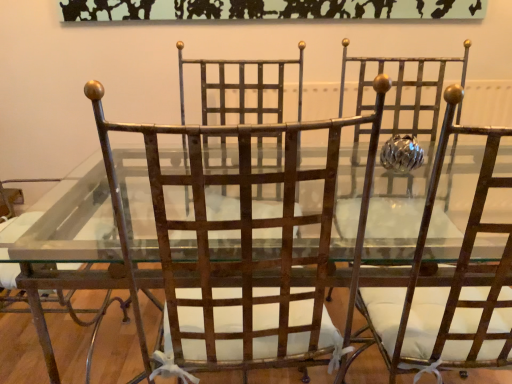
The height and width of the screenshot is (384, 512). What do you see at coordinates (447, 284) in the screenshot?
I see `rusty metal chair at center, which appears as the 3th chair when viewed from the left` at bounding box center [447, 284].

Measure the distance between point [266,283] and camera.

The distance of point [266,283] from camera is 35.47 inches.

Identify the location of rusty metal chair at center, which appears as the 3th chair when viewed from the left. (447, 284).

Measure the distance between rusty metal chair at left, arranged as the 1th chair when viewed from the left, and rusty metal chair at center, which appears as the 3th chair when viewed from the left.

rusty metal chair at left, arranged as the 1th chair when viewed from the left, and rusty metal chair at center, which appears as the 3th chair when viewed from the left, are 28.32 inches apart.

Is rusty metal chair at left, marked as the 3th chair in a right-to-left arrangement, facing towards rusty metal chair at center, which appears as the 3th chair when viewed from the left?

No, rusty metal chair at left, marked as the 3th chair in a right-to-left arrangement, is not facing towards rusty metal chair at center, which appears as the 3th chair when viewed from the left.

Is rusty metal chair at left, arranged as the 1th chair when viewed from the left, inside or outside of rusty metal chair at center, which appears as the 3th chair when viewed from the left?

rusty metal chair at left, arranged as the 1th chair when viewed from the left, exists outside the volume of rusty metal chair at center, which appears as the 3th chair when viewed from the left.

Is rusty metal chair at left, marked as the 3th chair in a right-to-left arrangement, bigger or smaller than rusty metal chair at center, arranged as the 1th chair when viewed from the right?

rusty metal chair at left, marked as the 3th chair in a right-to-left arrangement, is bigger than rusty metal chair at center, arranged as the 1th chair when viewed from the right.

Does rusty metal chair at left, marked as the 3th chair in a right-to-left arrangement, have a smaller size compared to rusty metal chair at center, which is counted as the 2th chair, starting from the right?

Incorrect, rusty metal chair at left, marked as the 3th chair in a right-to-left arrangement, is not smaller in size than rusty metal chair at center, which is counted as the 2th chair, starting from the right.

Is there a large distance between rusty metal chair at left, marked as the 3th chair in a right-to-left arrangement, and rusty metal chair at center, which is counted as the 2th chair, starting from the right?

No.

Is rusty metal chair at left, marked as the 3th chair in a right-to-left arrangement, oriented away from rusty metal chair at center, which is counted as the 2th chair, starting from the right?

No, rusty metal chair at left, marked as the 3th chair in a right-to-left arrangement, is not facing away from rusty metal chair at center, which is counted as the 2th chair, starting from the right.

Considering the relative sizes of rusty metal chair at left, marked as the 3th chair in a right-to-left arrangement, and rusty metal chair at center, acting as the 2th chair starting from the left, in the image provided, is rusty metal chair at left, marked as the 3th chair in a right-to-left arrangement, thinner than rusty metal chair at center, acting as the 2th chair starting from the left,?

Incorrect, the width of rusty metal chair at left, marked as the 3th chair in a right-to-left arrangement, is not less than that of rusty metal chair at center, acting as the 2th chair starting from the left.

Is point (153, 199) farther from camera compared to point (46, 338)?

No, it is not.

How many degrees apart are the facing directions of rusty metal chair at center, which is counted as the 2th chair, starting from the right, and rusty metal chair at left, marked as the 3th chair in a right-to-left arrangement?

The angular difference between rusty metal chair at center, which is counted as the 2th chair, starting from the right, and rusty metal chair at left, marked as the 3th chair in a right-to-left arrangement, is 6.52 degrees.

Could rusty metal chair at left, arranged as the 1th chair when viewed from the left, be considered to be inside rusty metal chair at center, acting as the 2th chair starting from the left?

No, rusty metal chair at left, arranged as the 1th chair when viewed from the left, is not a part of rusty metal chair at center, acting as the 2th chair starting from the left.

Relative to rusty metal chair at left, arranged as the 1th chair when viewed from the left, is rusty metal chair at center, which is counted as the 2th chair, starting from the right, in front or behind?

Clearly, rusty metal chair at center, which is counted as the 2th chair, starting from the right, is in front of rusty metal chair at left, arranged as the 1th chair when viewed from the left.

Can you confirm if rusty metal chair at center, acting as the 2th chair starting from the left, is bigger than rusty metal chair at center, which appears as the 3th chair when viewed from the left?

No.

How many degrees apart are the facing directions of rusty metal chair at center, acting as the 2th chair starting from the left, and rusty metal chair at center, which appears as the 3th chair when viewed from the left?

0.00026 degrees separate the facing orientations of rusty metal chair at center, acting as the 2th chair starting from the left, and rusty metal chair at center, which appears as the 3th chair when viewed from the left.

Is rusty metal chair at center, which is counted as the 2th chair, starting from the right, at the right side of rusty metal chair at center, which appears as the 3th chair when viewed from the left?

In fact, rusty metal chair at center, which is counted as the 2th chair, starting from the right, is to the left of rusty metal chair at center, which appears as the 3th chair when viewed from the left.

Is rusty metal chair at center, arranged as the 1th chair when viewed from the right, taller or shorter than rusty metal chair at center, which is counted as the 2th chair, starting from the right?

Clearly, rusty metal chair at center, arranged as the 1th chair when viewed from the right, is shorter compared to rusty metal chair at center, which is counted as the 2th chair, starting from the right.

Who is smaller, rusty metal chair at center, which appears as the 3th chair when viewed from the left, or rusty metal chair at center, acting as the 2th chair starting from the left?

Smaller between the two is rusty metal chair at center, acting as the 2th chair starting from the left.

From the image's perspective, relative to rusty metal chair at center, which is counted as the 2th chair, starting from the right, is rusty metal chair at center, arranged as the 1th chair when viewed from the right, above or below?

Clearly, from the image's perspective, rusty metal chair at center, arranged as the 1th chair when viewed from the right, is above rusty metal chair at center, which is counted as the 2th chair, starting from the right.

Is point (400, 313) farther from camera compared to point (375, 86)?

Yes, point (400, 313) is farther from viewer.

Which point is more forward, (389,371) or (71,292)?

Point (389,371)

Which is correct: rusty metal chair at center, arranged as the 1th chair when viewed from the right, is inside rusty metal chair at left, arranged as the 1th chair when viewed from the left, or outside of it?

rusty metal chair at center, arranged as the 1th chair when viewed from the right, lies outside rusty metal chair at left, arranged as the 1th chair when viewed from the left.

At what (x,y) coordinates should I click in order to perform the action: click on chair that is the 2nd one when counting leftward from the rusty metal chair at center, arranged as the 1th chair when viewed from the right. Please return your answer as a coordinate pair (x, y). This screenshot has width=512, height=384. Looking at the image, I should click on [88, 288].

From a real-world perspective, starting from the rusty metal chair at left, marked as the 3th chair in a right-to-left arrangement, which chair is the 2nd one vertically above it? Please provide its 2D coordinates.

[(447, 284)]

Find the location of `chair that is the 2nd one when counting upward from the rusty metal chair at center, which is counted as the 2th chair, starting from the right (from the image's perspective)`. chair that is the 2nd one when counting upward from the rusty metal chair at center, which is counted as the 2th chair, starting from the right (from the image's perspective) is located at coordinates (88, 288).

Looking at the image, which one is located further to rusty metal chair at left, arranged as the 1th chair when viewed from the left, rusty metal chair at center, which appears as the 3th chair when viewed from the left, or rusty metal chair at center, which is counted as the 2th chair, starting from the right?

The object further to rusty metal chair at left, arranged as the 1th chair when viewed from the left, is rusty metal chair at center, which appears as the 3th chair when viewed from the left.

Based on their spatial positions, is rusty metal chair at left, arranged as the 1th chair when viewed from the left, or rusty metal chair at center, arranged as the 1th chair when viewed from the right, further from rusty metal chair at center, acting as the 2th chair starting from the left?

rusty metal chair at left, arranged as the 1th chair when viewed from the left, is further to rusty metal chair at center, acting as the 2th chair starting from the left.

Considering their positions, is rusty metal chair at center, which is counted as the 2th chair, starting from the right, positioned further to rusty metal chair at center, arranged as the 1th chair when viewed from the right, than rusty metal chair at left, marked as the 3th chair in a right-to-left arrangement?

rusty metal chair at left, marked as the 3th chair in a right-to-left arrangement, is further to rusty metal chair at center, arranged as the 1th chair when viewed from the right.

When comparing their distances from rusty metal chair at center, which is counted as the 2th chair, starting from the right, does rusty metal chair at center, arranged as the 1th chair when viewed from the right, or rusty metal chair at left, marked as the 3th chair in a right-to-left arrangement, seem further?

rusty metal chair at left, marked as the 3th chair in a right-to-left arrangement.

Looking at this image, from the image, which object appears to be farther from rusty metal chair at left, arranged as the 1th chair when viewed from the left, rusty metal chair at center, acting as the 2th chair starting from the left, or rusty metal chair at center, arranged as the 1th chair when viewed from the right?

Based on the image, rusty metal chair at center, arranged as the 1th chair when viewed from the right, appears to be further to rusty metal chair at left, arranged as the 1th chair when viewed from the left.

Considering their positions, is rusty metal chair at left, arranged as the 1th chair when viewed from the left, positioned closer to rusty metal chair at center, arranged as the 1th chair when viewed from the right, than rusty metal chair at center, acting as the 2th chair starting from the left?

Based on the image, rusty metal chair at center, acting as the 2th chair starting from the left, appears to be nearer to rusty metal chair at center, arranged as the 1th chair when viewed from the right.

Where is `chair between rusty metal chair at left, marked as the 3th chair in a right-to-left arrangement, and rusty metal chair at center, which appears as the 3th chair when viewed from the left`? chair between rusty metal chair at left, marked as the 3th chair in a right-to-left arrangement, and rusty metal chair at center, which appears as the 3th chair when viewed from the left is located at coordinates (244, 246).